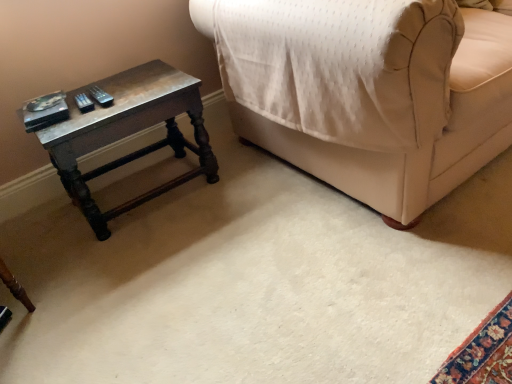
What are the coordinates of `vacant area on top of wooden table at left (from a real-world perspective)` in the screenshot? It's located at (120, 96).